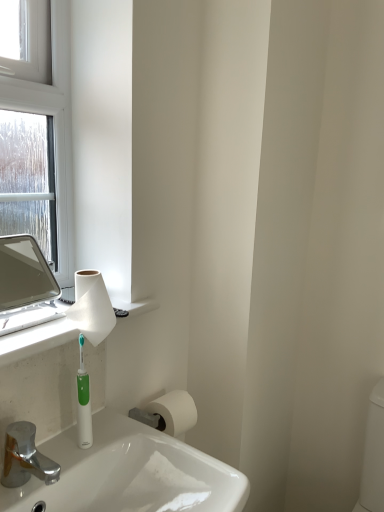
Question: Does chrome metallic faucet at lower left have a greater height compared to matte silver mirror at left?

Choices:
 (A) no
 (B) yes

Answer: (A)

Question: Is chrome metallic faucet at lower left oriented away from matte silver mirror at left?

Choices:
 (A) yes
 (B) no

Answer: (B)

Question: Is chrome metallic faucet at lower left shorter than matte silver mirror at left?

Choices:
 (A) no
 (B) yes

Answer: (B)

Question: Considering the relative positions of chrome metallic faucet at lower left and matte silver mirror at left in the image provided, is chrome metallic faucet at lower left in front of matte silver mirror at left?

Choices:
 (A) yes
 (B) no

Answer: (A)

Question: Is chrome metallic faucet at lower left placed right next to matte silver mirror at left?

Choices:
 (A) yes
 (B) no

Answer: (B)

Question: Is chrome metallic faucet at lower left at the left side of matte silver mirror at left?

Choices:
 (A) no
 (B) yes

Answer: (A)

Question: From a real-world perspective, is green plastic toothbrush at lower left physically below chrome metallic faucet at lower left?

Choices:
 (A) yes
 (B) no

Answer: (B)

Question: Considering the relative positions of green plastic toothbrush at lower left and chrome metallic faucet at lower left in the image provided, is green plastic toothbrush at lower left to the right of chrome metallic faucet at lower left from the viewer's perspective?

Choices:
 (A) no
 (B) yes

Answer: (B)

Question: Does green plastic toothbrush at lower left have a lesser width compared to chrome metallic faucet at lower left?

Choices:
 (A) no
 (B) yes

Answer: (B)

Question: Does green plastic toothbrush at lower left appear on the left side of chrome metallic faucet at lower left?

Choices:
 (A) no
 (B) yes

Answer: (A)

Question: Could you tell me if green plastic toothbrush at lower left is turned towards chrome metallic faucet at lower left?

Choices:
 (A) no
 (B) yes

Answer: (A)

Question: Would you consider green plastic toothbrush at lower left to be distant from chrome metallic faucet at lower left?

Choices:
 (A) no
 (B) yes

Answer: (A)

Question: Can you confirm if chrome metallic faucet at lower left is wider than white matte toilet paper at lower center, the 2th toilet paper when ordered from top to bottom?

Choices:
 (A) no
 (B) yes

Answer: (B)